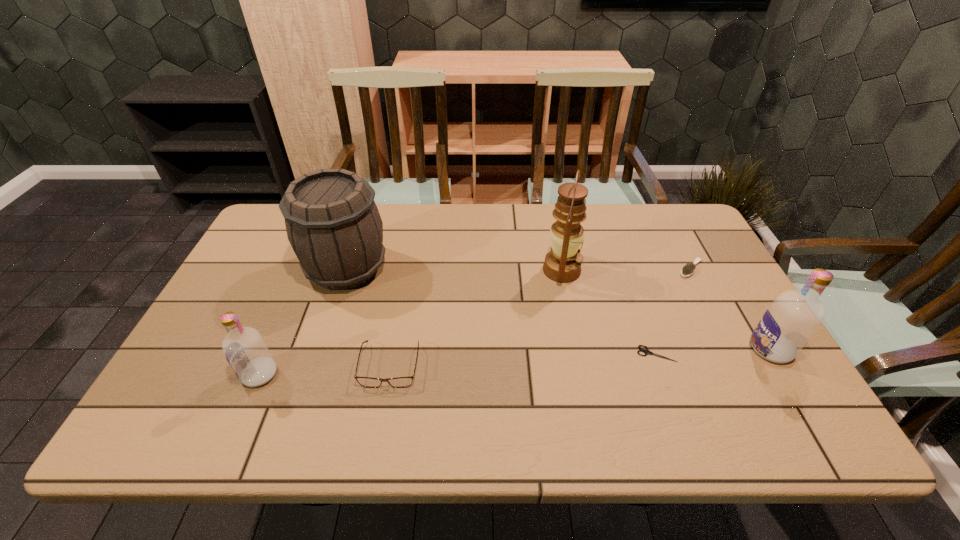
You are a GUI agent. You are given a task and a screenshot of the screen. Output one action in this format:
    pyautogui.click(x=<x>, y=<y>)
    Task: Click on the spectacles present at the near edge
    This screenshot has height=540, width=960.
    Given the screenshot: What is the action you would take?
    pyautogui.click(x=400, y=382)

Locate an element on the screen. object that is at the left edge is located at coordinates (245, 350).

Find the location of `vodka that is at the right edge`. vodka that is at the right edge is located at coordinates (794, 316).

At what (x,y) coordinates should I click in order to perform the action: click on scrubbing brush present at the right edge. Please return your answer as a coordinate pair (x, y). Looking at the image, I should click on (688, 269).

Identify the location of object that is at the near left corner. Image resolution: width=960 pixels, height=540 pixels. (245, 350).

This screenshot has height=540, width=960. In order to click on free space at the far edge of the desktop in this screenshot , I will do `click(445, 225)`.

The height and width of the screenshot is (540, 960). Find the location of `vacant space at the near edge of the desktop`. vacant space at the near edge of the desktop is located at coordinates (714, 394).

Locate an element on the screen. Image resolution: width=960 pixels, height=540 pixels. vacant region at the right edge of the desktop is located at coordinates (720, 279).

The width and height of the screenshot is (960, 540). Identify the location of vacant space at the far left corner. (266, 244).

At what (x,y) coordinates should I click in order to perform the action: click on free spot at the near left corner of the desktop. Please return your answer as a coordinate pair (x, y). This screenshot has width=960, height=540. Looking at the image, I should click on 206,386.